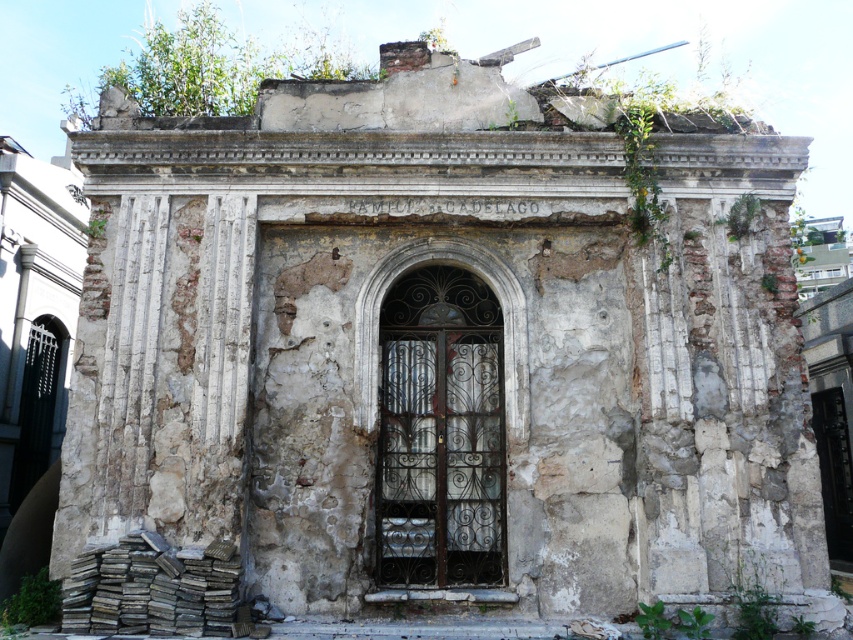
Question: Is green leafy plant at upper right above green leafy weed at lower right?

Choices:
 (A) yes
 (B) no

Answer: (A)

Question: Can you confirm if green leafy vegetation at lower left is positioned below green leafy weed at lower right?

Choices:
 (A) yes
 (B) no

Answer: (B)

Question: Where is green leafy vegetation at lower left located in relation to green leafy weed at lower right in the image?

Choices:
 (A) left
 (B) right

Answer: (A)

Question: Which object is farther from the camera taking this photo?

Choices:
 (A) green leafy plant at upper right
 (B) green leafy weed at lower right

Answer: (A)

Question: Which is farther from the green leafy plant at upper right?

Choices:
 (A) green leafy weed at lower right
 (B) green leafy vegetation at lower left

Answer: (B)

Question: Which object is farther from the camera taking this photo?

Choices:
 (A) green leafy vegetation at lower left
 (B) green leafy plant at upper right

Answer: (B)